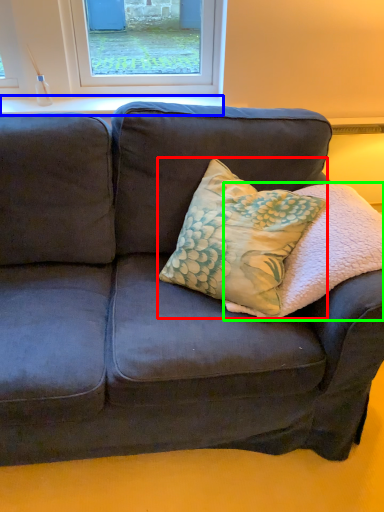
Question: Considering the real-world distances, which object is closest to throw pillow (highlighted by a red box)? window sill (highlighted by a blue box) or pillow (highlighted by a green box).

Choices:
 (A) window sill
 (B) pillow

Answer: (B)